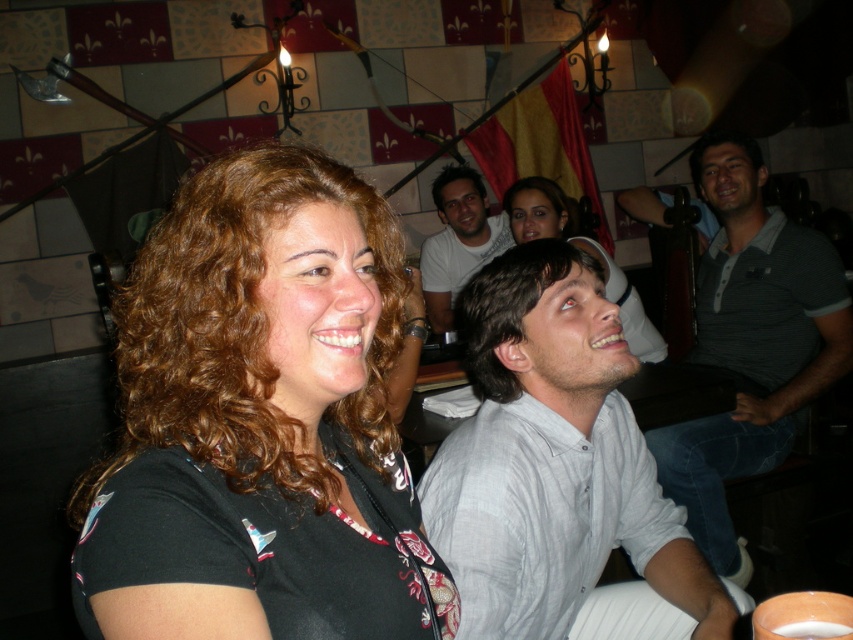
Question: From the image, what is the correct spatial relationship of gray striped polo shirt at upper right in relation to white frothy liquid at center?

Choices:
 (A) right
 (B) left

Answer: (A)

Question: Does dark brown smooth hair at center appear over matte black shirt at center?

Choices:
 (A) yes
 (B) no

Answer: (B)

Question: Estimate the real-world distances between objects in this image. Which object is closer to the brown curly hair at left?

Choices:
 (A) dark brown smooth hair at center
 (B) white shirt at center
 (C) brown curly hair at center

Answer: (A)

Question: Which is nearer to the brown curly hair at center?

Choices:
 (A) white frothy liquid at center
 (B) brown curly hair at left
 (C) dark brown curly hair at upper center
 (D) dark brown curly hair at upper right

Answer: (D)

Question: Which object appears closest to the camera in this image?

Choices:
 (A) dark brown smooth hair at center
 (B) white shirt at center

Answer: (A)

Question: Can you confirm if gray striped polo shirt at upper right is smaller than dark brown smooth hair at center?

Choices:
 (A) yes
 (B) no

Answer: (B)